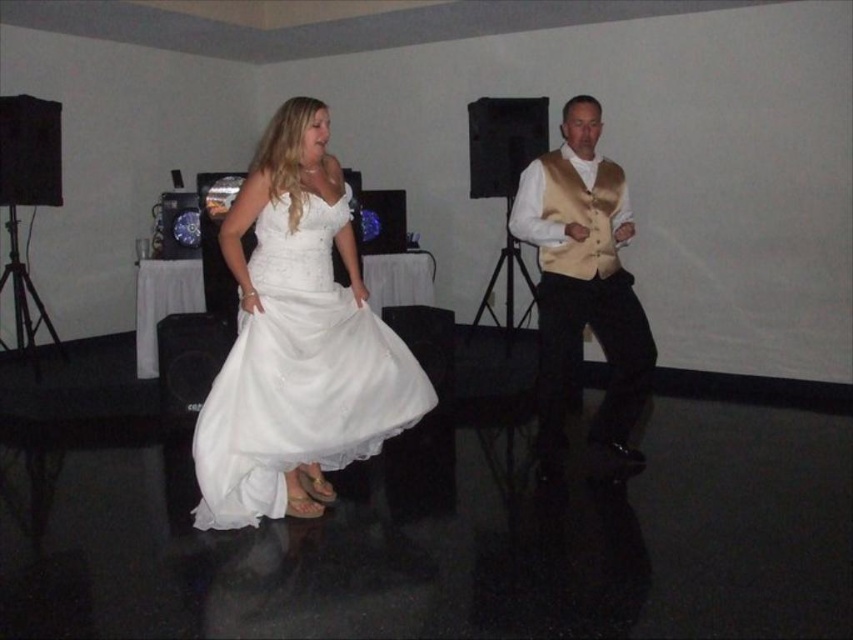
Question: Can you confirm if white satin dress at center is positioned to the left of shiny gold vest at center?

Choices:
 (A) yes
 (B) no

Answer: (A)

Question: Which point is closer to the camera?

Choices:
 (A) shiny gold vest at center
 (B) white satin dress at center

Answer: (B)

Question: Which of the following is the farthest from the observer?

Choices:
 (A) white satin dress at center
 (B) shiny gold vest at center

Answer: (B)

Question: Is white satin dress at center positioned before shiny gold vest at center?

Choices:
 (A) no
 (B) yes

Answer: (B)

Question: From the image, what is the correct spatial relationship of white satin dress at center in relation to shiny gold vest at center?

Choices:
 (A) left
 (B) right

Answer: (A)

Question: Which of the following is the farthest from the observer?

Choices:
 (A) (556, 316)
 (B) (410, 417)

Answer: (A)